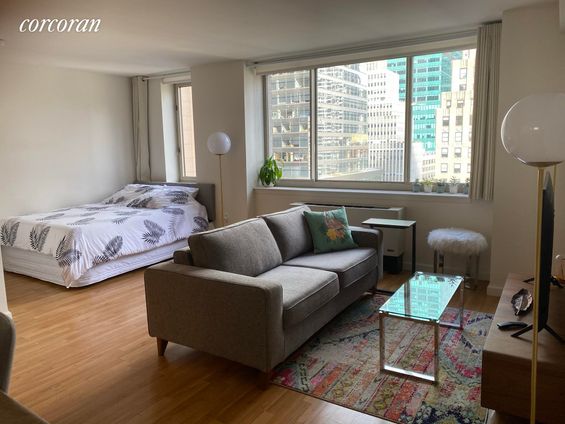
Find the location of `white lamp shade`. white lamp shade is located at coordinates (217, 147), (538, 143).